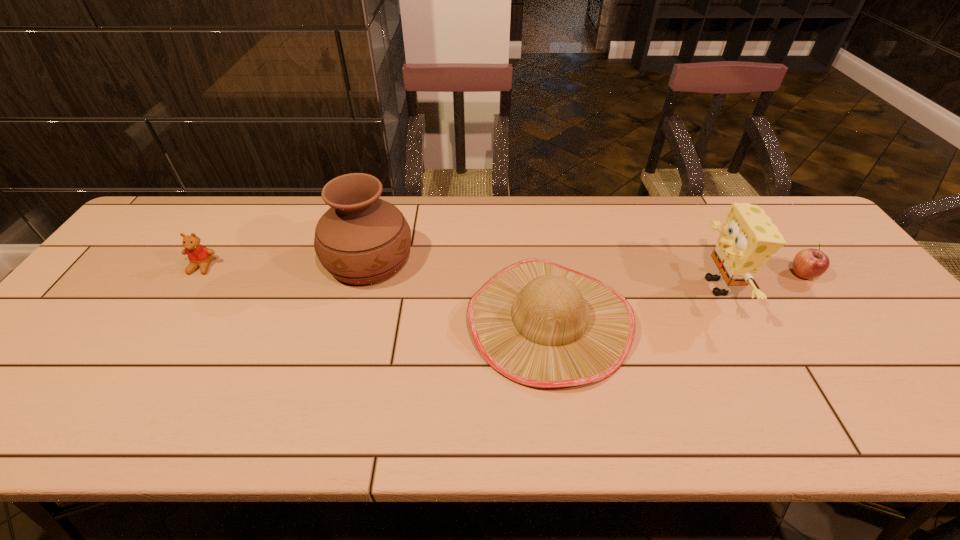
Identify the location of vacant point located 0.180m on the face of the sponge. This screenshot has width=960, height=540. (631, 286).

Locate an element on the screen. vacant space located on the back of the third object from right to left is located at coordinates (535, 221).

The image size is (960, 540). What are the coordinates of `vacant space located 0.320m on the front-facing side of the teddy bear` in the screenshot? It's located at (131, 376).

The height and width of the screenshot is (540, 960). What are the coordinates of `vacant area situated on the right of the shortest object` in the screenshot? It's located at (835, 274).

The width and height of the screenshot is (960, 540). In order to click on object present at the far edge in this screenshot , I will do `click(361, 239)`.

The width and height of the screenshot is (960, 540). In order to click on object at the right edge in this screenshot , I will do `click(809, 263)`.

I want to click on free spot at the far edge of the desktop, so click(x=472, y=238).

Identify the location of free space at the near edge of the desktop. The width and height of the screenshot is (960, 540). (274, 422).

Image resolution: width=960 pixels, height=540 pixels. What are the coordinates of `vacant space at the left edge of the desktop` in the screenshot? It's located at (x=66, y=378).

At what (x,y) coordinates should I click in order to perform the action: click on vacant space at the right edge of the desktop. Please return your answer as a coordinate pair (x, y). Looking at the image, I should click on (825, 308).